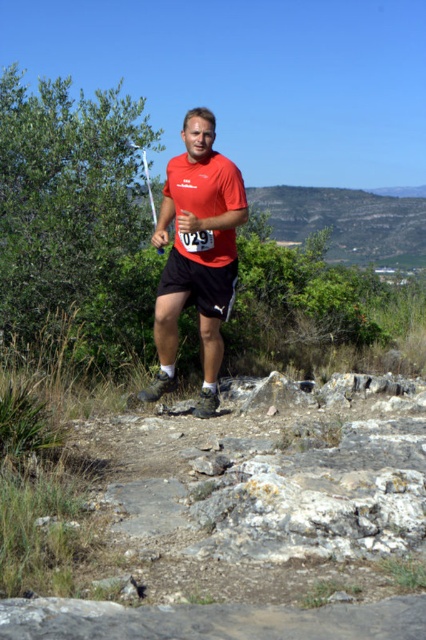
Is matte red shirt at center further to camera compared to rugged stone hillside at upper center?

No, matte red shirt at center is in front of rugged stone hillside at upper center.

Image resolution: width=426 pixels, height=640 pixels. What do you see at coordinates (196, 253) in the screenshot?
I see `matte red shirt at center` at bounding box center [196, 253].

Identify the location of matte red shirt at center. (196, 253).

Is matte red shirt at center wider than black matte shorts at center?

Yes.

Does point (167, 193) lie behind point (166, 272)?

Yes.

I want to click on matte red shirt at center, so click(196, 253).

Does point (354, 253) lie in front of point (215, 310)?

No, (354, 253) is further to viewer.

Is rugged stone hillside at upper center smaller than black matte shorts at center?

Incorrect, rugged stone hillside at upper center is not smaller in size than black matte shorts at center.

The image size is (426, 640). What are the coordinates of `rugged stone hillside at upper center` in the screenshot? It's located at (348, 221).

The height and width of the screenshot is (640, 426). Find the location of `rugged stone hillside at upper center`. rugged stone hillside at upper center is located at coordinates (348, 221).